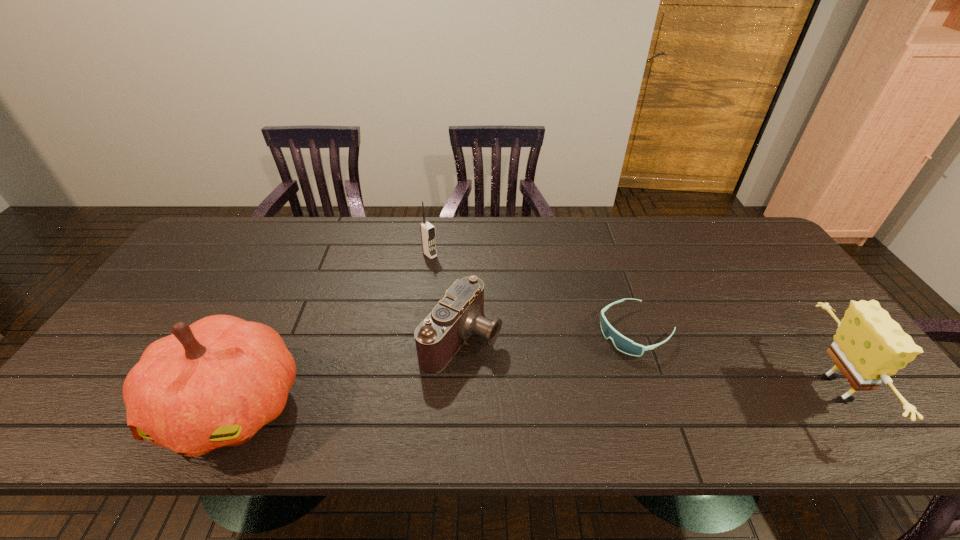
The image size is (960, 540). Find the location of `vacant space that satisfies the following two spatial constraints: 1. on the front side of the sponge; 2. on the face of the third tallest object`. vacant space that satisfies the following two spatial constraints: 1. on the front side of the sponge; 2. on the face of the third tallest object is located at coordinates (412, 389).

Image resolution: width=960 pixels, height=540 pixels. I want to click on free space that satisfies the following two spatial constraints: 1. on the front side of the farthest object; 2. on the right side of the camera, so click(x=419, y=338).